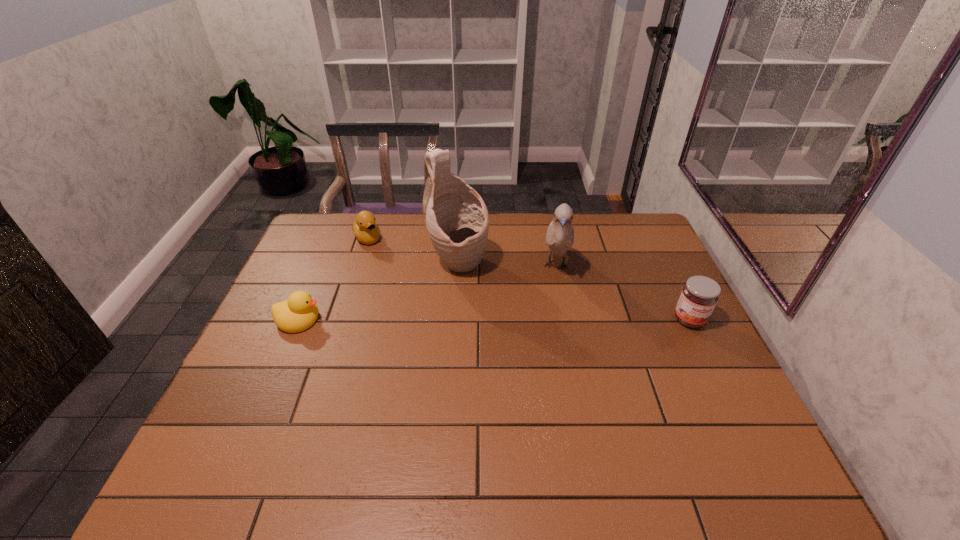
Image resolution: width=960 pixels, height=540 pixels. I want to click on duckling that is at the far edge, so click(x=364, y=228).

Identify the location of pitcher that is at the far edge. The image size is (960, 540). (457, 220).

The image size is (960, 540). I want to click on bird situated at the far edge, so click(x=560, y=234).

What are the coordinates of `object that is at the left edge` in the screenshot? It's located at (299, 312).

The image size is (960, 540). I want to click on object that is at the right edge, so click(x=699, y=296).

The height and width of the screenshot is (540, 960). In the image, there is a desktop. Find the location of `vacant space at the far edge`. vacant space at the far edge is located at coordinates (490, 237).

This screenshot has width=960, height=540. I want to click on free space at the near edge, so click(636, 436).

In the image, there is a desktop. Where is `vacant region at the left edge`? The image size is (960, 540). vacant region at the left edge is located at coordinates point(305,254).

Find the location of a particular element. This screenshot has height=540, width=960. vacant region at the right edge of the desktop is located at coordinates (698, 389).

Locate an element on the screen. Image resolution: width=960 pixels, height=540 pixels. free point at the far left corner is located at coordinates (349, 230).